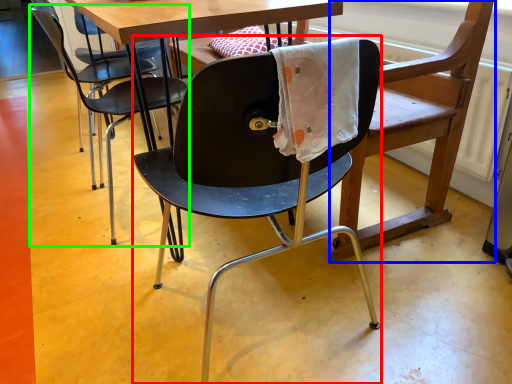
Question: Which object is positioned farthest from chair (highlighted by a red box)? Select from swivel chair (highlighted by a blue box) and chair (highlighted by a green box).

Choices:
 (A) swivel chair
 (B) chair

Answer: (B)